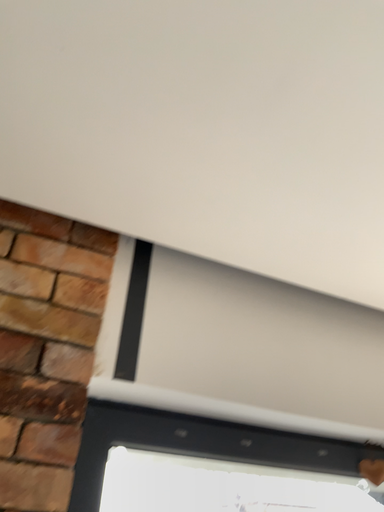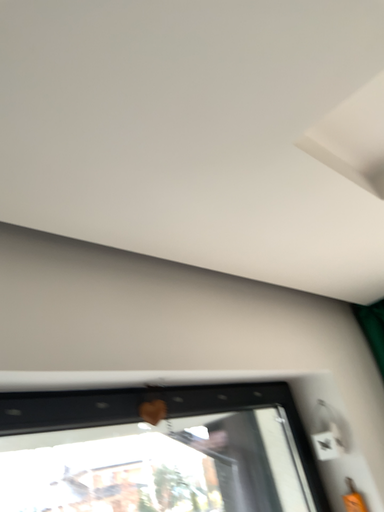
Question: How did the camera likely rotate when shooting the video?

Choices:
 (A) rotated left
 (B) rotated right

Answer: (B)